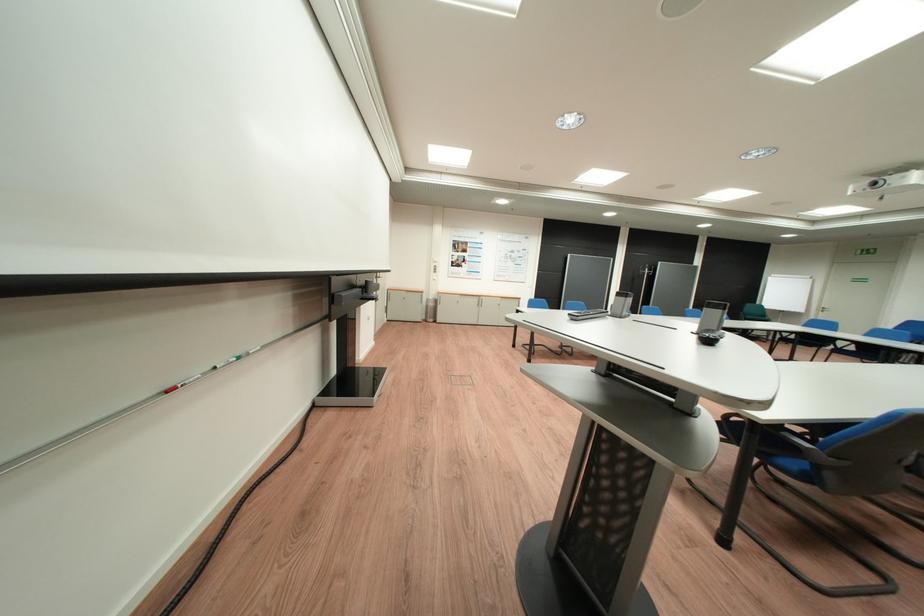
Identify the location of white door handle. (824, 309).